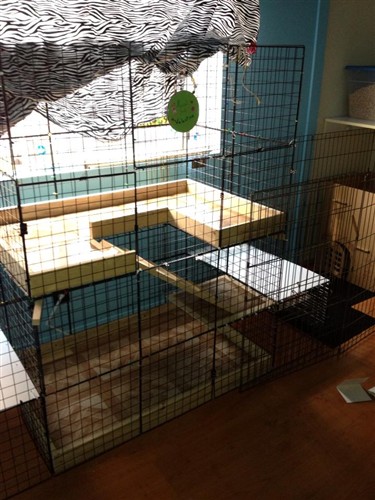
In order to click on stairs in this screenshot , I will do `click(191, 287)`.